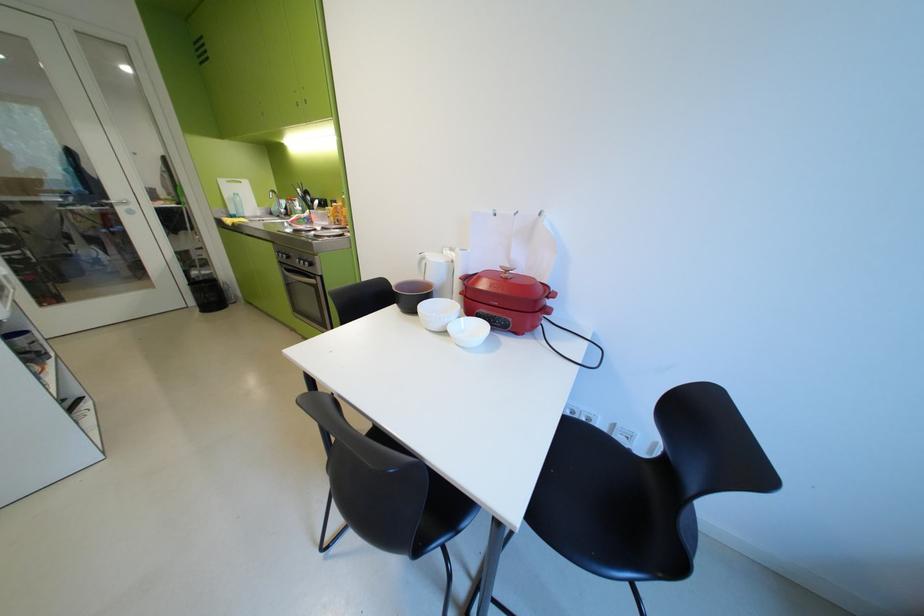
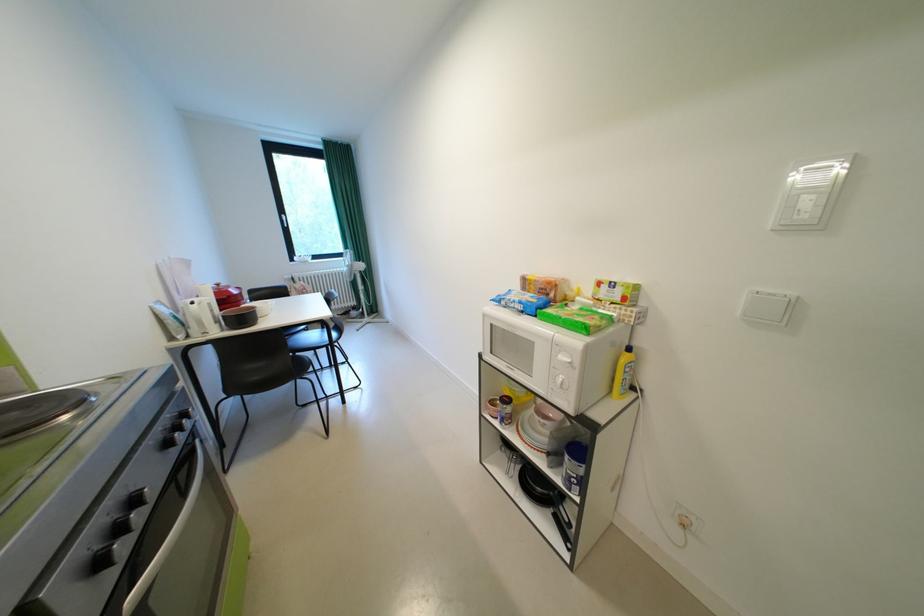
In the second image, find the point that corresponds to point (517, 272) in the first image.

(228, 286)